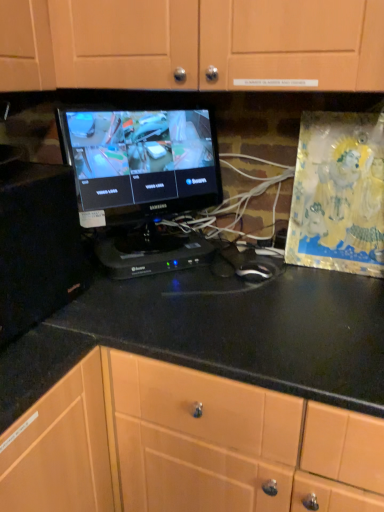
At what (x,y) coordinates should I click in order to perform the action: click on vacant space situated above black glossy countertop at center (from a real-world perspective). Please return your answer as a coordinate pair (x, y). This screenshot has height=512, width=384. Looking at the image, I should click on (274, 313).